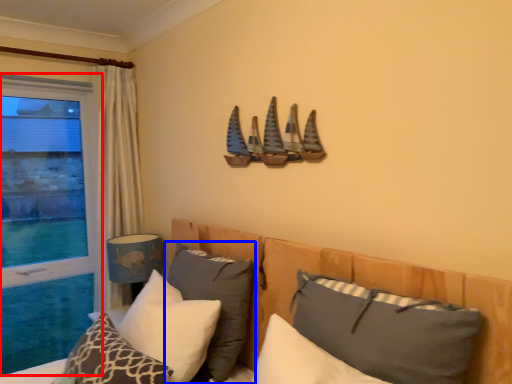
Question: Which of the following is the farthest to the observer, window (highlighted by a red box) or pillow (highlighted by a blue box)?

Choices:
 (A) window
 (B) pillow

Answer: (A)